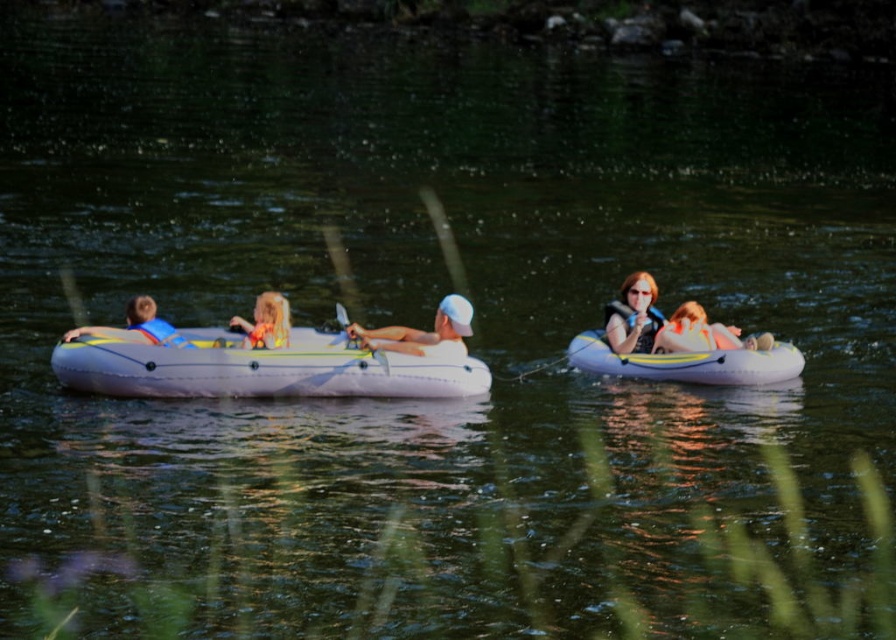
You are a swimmer who wants to grab the multicolored fabric toy at center from the water. You can only reach forward from where you are currently standing near the matte black life vest at right. Can you reach it without moving your position?

The multicolored fabric toy at center is behind the matte black life vest at right, so you cannot reach it without moving your position because it is positioned behind the life vest.

You are a swimmer who wants to use either the translucent yellow tube at center or the white matte life vest at center for floating. Which one would provide more stability due to its larger size?

The translucent yellow tube at center has a larger width than the white matte life vest at center, so it would provide more stability for floating.

You are standing on the inflatable raft and want to grab the matte black life vest at right. Based on its 2D coordinates, in which direction should you move to reach it?

The matte black life vest at right is located at coordinates 0.494 on the x axis and 0.708 on the y axis. Since the coordinate system is normalized between 0 and 1, with the origin at the bottom left corner, moving towards the right and slightly upwards would allow you to reach the matte black life vest at right.